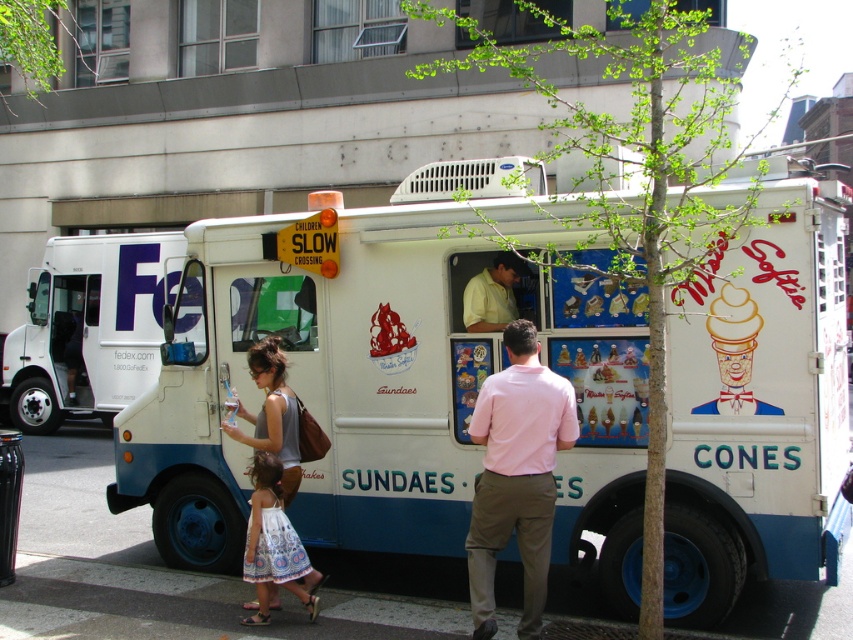
Question: Estimate the real-world distances between objects in this image. Which object is farther from the white matte ice cream truck at center?

Choices:
 (A) matte gray tank top at center
 (B) yellow matte shirt at center
 (C) pink cotton shirt at center
 (D) white printed dress at lower center

Answer: (D)

Question: Is pink cotton shirt at center thinner than white printed dress at lower center?

Choices:
 (A) no
 (B) yes

Answer: (A)

Question: In this image, where is white matte ice cream truck at center located relative to yellow matte shirt at center?

Choices:
 (A) right
 (B) left

Answer: (B)

Question: Which of the following is the farthest from the observer?

Choices:
 (A) (573, 278)
 (B) (544, 474)

Answer: (A)

Question: Can you confirm if white matte ice cream truck at center is positioned above yellow matte shirt at center?

Choices:
 (A) no
 (B) yes

Answer: (A)

Question: Among these objects, which one is nearest to the camera?

Choices:
 (A) matte gray tank top at center
 (B) yellow matte shirt at center
 (C) pink cotton shirt at center

Answer: (C)